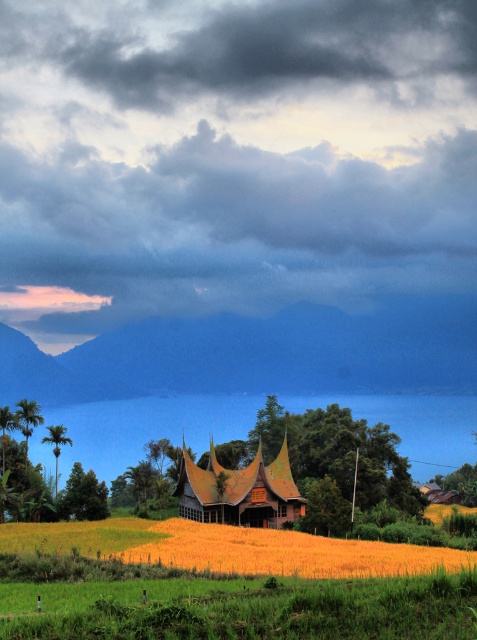
Question: Which of these objects is positioned closest to the wooden hut at center?

Choices:
 (A) yellow grassy field at center
 (B) green leafy palm at lower left
 (C) green leafy palm tree at left
 (D) cloudy sky at upper center

Answer: (A)

Question: From the image, what is the correct spatial relationship of yellow grassy field at center in relation to green leafy palm tree at left?

Choices:
 (A) below
 (B) above

Answer: (A)

Question: Which point is farther to the camera?

Choices:
 (A) green leafy palm tree at left
 (B) yellow grassy field at center

Answer: (A)

Question: Can you confirm if wooden hut at center is positioned to the left of green leafy palm tree at left?

Choices:
 (A) yes
 (B) no

Answer: (B)

Question: Does yellow grassy field at center appear on the left side of green leafy palm at lower left?

Choices:
 (A) no
 (B) yes

Answer: (A)

Question: Estimate the real-world distances between objects in this image. Which object is closer to the green leafy palm at lower left?

Choices:
 (A) cloudy sky at upper center
 (B) green leafy palm tree at left

Answer: (B)